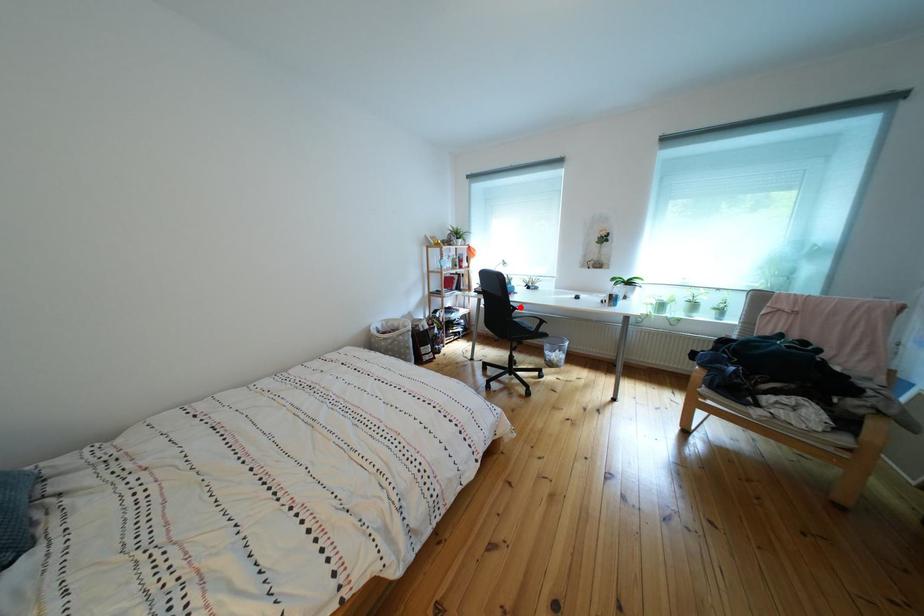
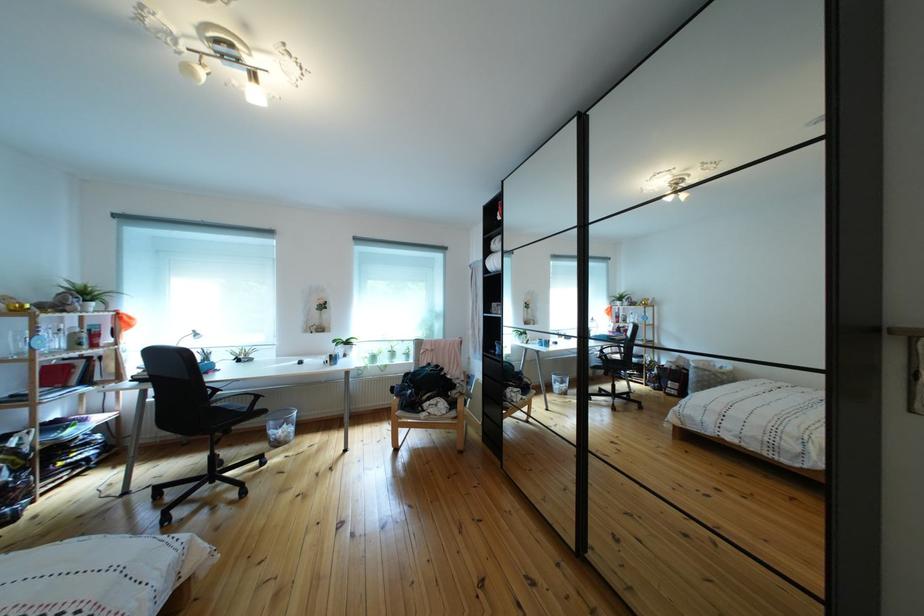
Question: I am providing you with two images of the same scene from different viewpoints. Given a red point in image1, look at the same physical point in image2. Is it:

Choices:
 (A) Closer to the viewpoint
 (B) Farther from the viewpoint

Answer: (A)